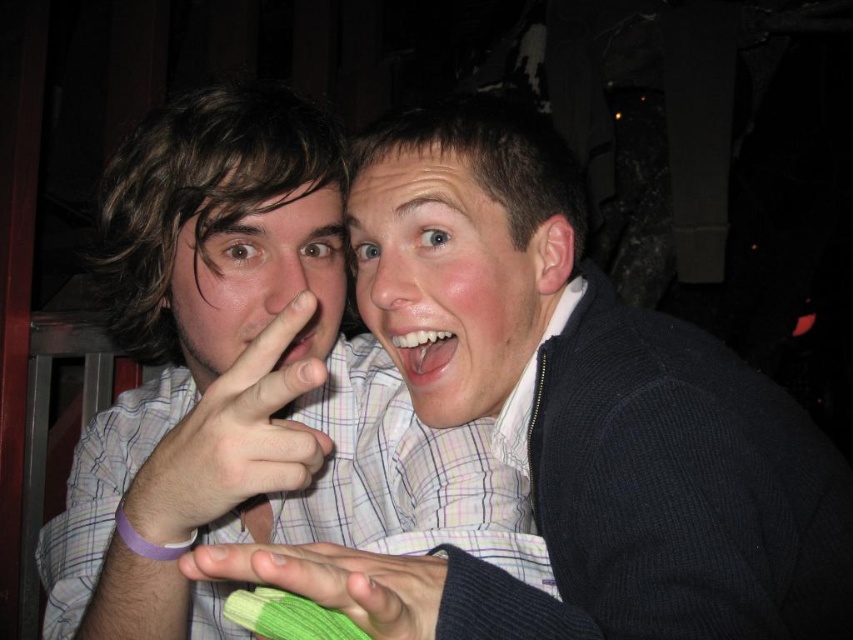
Can you confirm if white matte hand at center is positioned above white glossy teeth at center?

No, white matte hand at center is not above white glossy teeth at center.

Between white matte hand at center and white glossy teeth at center, which one appears on the left side from the viewer's perspective?

From the viewer's perspective, white matte hand at center appears more on the left side.

This screenshot has width=853, height=640. I want to click on white matte hand at center, so coord(233,440).

Find the location of a particular element. The height and width of the screenshot is (640, 853). white matte hand at center is located at coordinates (233, 440).

Which is in front, point (398, 355) or point (209, 413)?

Point (209, 413) is more forward.

Who is taller, smooth skin face at center or white matte hand at center?

smooth skin face at center is taller.

Who is more distant from viewer, (367, 273) or (260, 426)?

Positioned behind is point (367, 273).

The image size is (853, 640). Identify the location of smooth skin face at center. coord(445,280).

Between matte white face at center and pink glossy lips at center, which one has less height?

pink glossy lips at center is shorter.

Can you confirm if matte white face at center is positioned to the left of pink glossy lips at center?

Yes, matte white face at center is to the left of pink glossy lips at center.

Where is `matte white face at center`? matte white face at center is located at coordinates (257, 276).